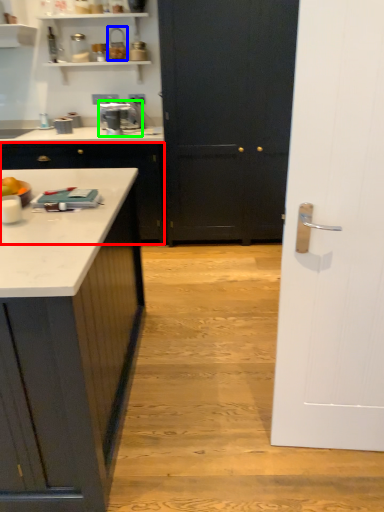
Question: Which object is positioned farthest from cabinetry (highlighted by a red box)? Select from appliance (highlighted by a blue box) and home appliance (highlighted by a green box).

Choices:
 (A) appliance
 (B) home appliance

Answer: (A)